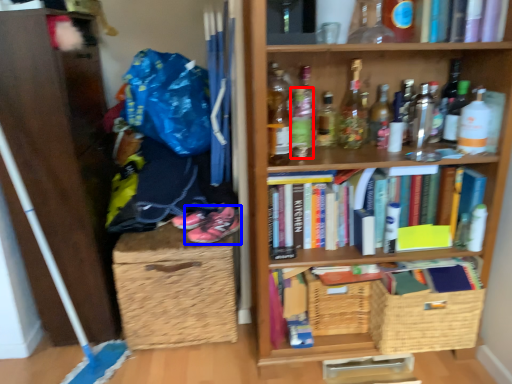
Question: Which point is further to the camera, bottle (highlighted by a red box) or footwear (highlighted by a blue box)?

Choices:
 (A) bottle
 (B) footwear

Answer: (B)